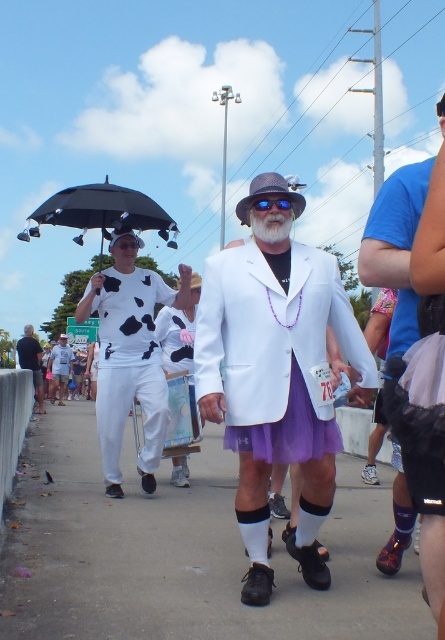
You are a photographer at the event and want to capture both the purple tulle skirt at center and the purple satin skirt at center in a single frame. Which skirt should you focus on to ensure both are visible without cropping?

The purple tulle skirt at center is wider than the purple satin skirt at center, so focusing on the purple tulle skirt at center will ensure both are visible without cropping.

You are standing at the origin point in the image. Which of the two points, point (385, 230) or point (60, 368), is closer to you?

Point (385, 230) is in front of point (60, 368), so it is closer to you.